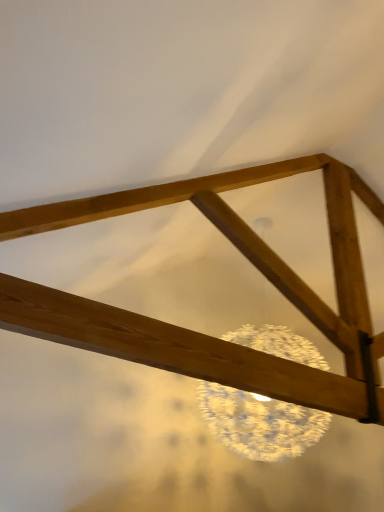
Question: Should I look upward or downward to see natural wood frame at upper center?

Choices:
 (A) up
 (B) down

Answer: (A)